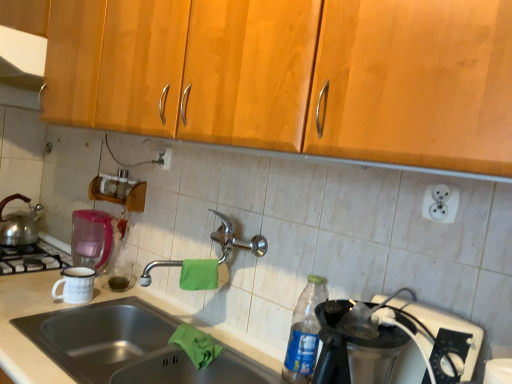
At what (x,y) coordinates should I click in order to perform the action: click on green cloth at sink, which ranks as the second material in top-to-bottom order. Please return your answer as a coordinate pair (x, y). This screenshot has width=512, height=384. Looking at the image, I should click on (196, 345).

In order to face stainless steel sink at lower left, should I rotate leftwards or rightwards?

To align with it, rotate left about 14.226°.

Where is `stainless steel sink at lower left`? This screenshot has width=512, height=384. stainless steel sink at lower left is located at coordinates (130, 347).

Describe the element at coordinates (199, 274) in the screenshot. This screenshot has width=512, height=384. I see `green cloth at center, acting as the 1th material starting from the top` at that location.

At what (x,y) coordinates should I click in order to perform the action: click on green cloth at center, acting as the 2th material starting from the bottom. Please return your answer as a coordinate pair (x, y). Looking at the image, I should click on (199, 274).

Image resolution: width=512 pixels, height=384 pixels. I want to click on white plastic outlet at upper right, the second electric outlet from the back, so click(x=440, y=203).

Identify the location of green cloth at sink, which ranks as the second material in top-to-bottom order. (196, 345).

Is pink plastic coffee machine at left shorter than white plastic electric outlet at upper center, arranged as the 1th electric outlet when viewed from the top?

In fact, pink plastic coffee machine at left may be taller than white plastic electric outlet at upper center, arranged as the 1th electric outlet when viewed from the top.

Do you think pink plastic coffee machine at left is within white plastic electric outlet at upper center, which appears as the second electric outlet when viewed from the right, or outside of it?

pink plastic coffee machine at left is spatially situated outside white plastic electric outlet at upper center, which appears as the second electric outlet when viewed from the right.

Is pink plastic coffee machine at left further to camera compared to white plastic electric outlet at upper center, placed as the first electric outlet when sorted from left to right?

That is True.

Is pink plastic coffee machine at left smaller than white plastic electric outlet at upper center, the second electric outlet viewed from the front?

Actually, pink plastic coffee machine at left might be larger than white plastic electric outlet at upper center, the second electric outlet viewed from the front.

Which object is positioned more to the left, shiny silver tea pot at left or white enamel mug at left?

shiny silver tea pot at left.

How different are the orientations of shiny silver tea pot at left and white enamel mug at left in degrees?

0.00384 degrees.

From the image's perspective, is shiny silver tea pot at left under white enamel mug at left?

No.

Is shiny silver tea pot at left positioned with its back to white enamel mug at left?

No, shiny silver tea pot at left's orientation is not away from white enamel mug at left.

From a real-world perspective, who is located higher, white plastic outlet at upper right, placed as the first electric outlet when sorted from front to back, or green cloth at sink, which ranks as the second material in top-to-bottom order?

In real-world perspective, white plastic outlet at upper right, placed as the first electric outlet when sorted from front to back, is above.

Between white plastic outlet at upper right, placed as the first electric outlet when sorted from front to back, and green cloth at sink, the first material positioned from the bottom, which one appears on the right side from the viewer's perspective?

From the viewer's perspective, white plastic outlet at upper right, placed as the first electric outlet when sorted from front to back, appears more on the right side.

Is point (444, 195) closer or farther from the camera than point (173, 335)?

Clearly, point (444, 195) is closer to the camera than point (173, 335).

Is pink plastic coffee machine at left positioned beyond the bounds of white plastic outlet at upper right, placed as the first electric outlet when sorted from front to back?

Yes, pink plastic coffee machine at left is located beyond the bounds of white plastic outlet at upper right, placed as the first electric outlet when sorted from front to back.

From a real-world perspective, which is physically below, pink plastic coffee machine at left or white plastic outlet at upper right, the second electric outlet from the back?

From a 3D spatial view, pink plastic coffee machine at left is below.

Could you tell me if pink plastic coffee machine at left is turned towards white plastic outlet at upper right, which is the first electric outlet from right to left?

No, pink plastic coffee machine at left is not aimed at white plastic outlet at upper right, which is the first electric outlet from right to left.

Who is bigger, shiny silver tea pot at left or green cloth at center, acting as the 2th material starting from the bottom?

shiny silver tea pot at left.

Could you tell me if shiny silver tea pot at left is facing green cloth at center, acting as the 2th material starting from the bottom?

No.

Which of these two, shiny silver tea pot at left or green cloth at center, acting as the 2th material starting from the bottom, is thinner?

green cloth at center, acting as the 2th material starting from the bottom, is thinner.

From the image's perspective, is shiny silver tea pot at left on green cloth at center, acting as the 1th material starting from the top?

Yes.

From a real-world perspective, between green cloth at sink, the first material positioned from the bottom, and polished metal faucet at center, who is vertically lower?

green cloth at sink, the first material positioned from the bottom.

Which is farther from the camera, (207, 342) or (220, 214)?

The point (220, 214) is farther from the camera.

Measure the distance from pink plastic coffee machine at left to shiny silver tea pot at left.

pink plastic coffee machine at left and shiny silver tea pot at left are 19.72 inches apart.

Is pink plastic coffee machine at left to the left or to the right of shiny silver tea pot at left in the image?

pink plastic coffee machine at left is to the right of shiny silver tea pot at left.

From the image's perspective, who appears lower, pink plastic coffee machine at left or shiny silver tea pot at left?

pink plastic coffee machine at left is shown below in the image.

Based on the photo, from a real-world perspective, is pink plastic coffee machine at left positioned above or below shiny silver tea pot at left?

In terms of real-world spatial position, pink plastic coffee machine at left is above shiny silver tea pot at left.

This screenshot has width=512, height=384. Identify the location of the 1st electric outlet positioned above the pink plastic coffee machine at left (from a real-world perspective). (164, 158).

In order to click on appliance below the shiny silver tea pot at left (from the image's perspective) in this screenshot , I will do `click(76, 285)`.

Looking at the image, which one is located closer to white enamel mug at left, shiny silver tea pot at left or white plastic outlet at upper right, acting as the 2th electric outlet starting from the top?

shiny silver tea pot at left is closer to white enamel mug at left.

Estimate the real-world distances between objects in this image. Which object is closer to white plastic electric outlet at upper center, the second electric outlet viewed from the front, stainless steel sink at lower left or polished metal faucet at center?

polished metal faucet at center.

From the image, which object appears to be nearer to pink plastic coffee machine at left, shiny silver tea pot at left or polished metal faucet at center?

polished metal faucet at center is positioned closer to the anchor pink plastic coffee machine at left.

From the image, which object appears to be farther from polished metal faucet at center, clear plastic bottle at lower right or pink plastic coffee machine at left?

pink plastic coffee machine at left is positioned further to the anchor polished metal faucet at center.

From the image, which object appears to be farther from shiny silver tea pot at left, polished metal faucet at center or clear plastic bottle at lower right?

clear plastic bottle at lower right.

Estimate the real-world distances between objects in this image. Which object is closer to shiny silver tea pot at left, polished metal faucet at center or green cloth at center, acting as the 1th material starting from the top?

Based on the image, polished metal faucet at center appears to be nearer to shiny silver tea pot at left.

Looking at the image, which one is located further to white plastic electric outlet at upper center, arranged as the 1th electric outlet when viewed from the top, shiny silver tea pot at left or clear plastic bottle at lower right?

shiny silver tea pot at left.

Considering their positions, is shiny silver tea pot at left positioned further to polished metal faucet at center than pink plastic coffee machine at left?

The object further to polished metal faucet at center is shiny silver tea pot at left.

What are the coordinates of `electric outlet between shiny silver tea pot at left and polished metal faucet at center from left to right` in the screenshot? It's located at (164, 158).

Locate an element on the screen. The image size is (512, 384). coffee machine between shiny silver tea pot at left and white plastic outlet at upper right, which appears as the 2th electric outlet when viewed from the left, in the horizontal direction is located at coordinates (91, 238).

You are a GUI agent. You are given a task and a screenshot of the screen. Output one action in this format:
    pyautogui.click(x=<x>, y=<y>)
    Task: Click on the bottle situated between shiny silver tea pot at left and white plastic outlet at upper right, the first electric outlet in the bottom-to-top sequence, from left to right
    The height and width of the screenshot is (384, 512).
    Given the screenshot: What is the action you would take?
    pyautogui.click(x=304, y=333)

Locate an element on the screen. The width and height of the screenshot is (512, 384). coffee machine situated between shiny silver tea pot at left and white plastic electric outlet at upper center, the second electric outlet in the bottom-to-top sequence, from left to right is located at coordinates (91, 238).